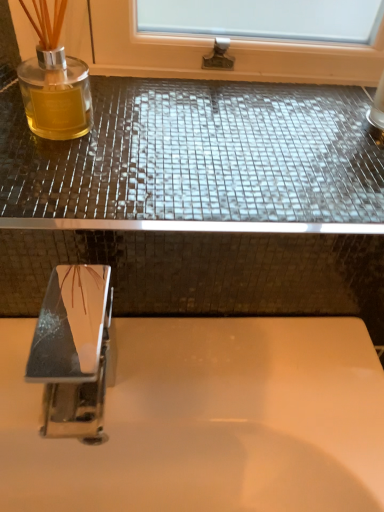
You are a GUI agent. You are given a task and a screenshot of the screen. Output one action in this format:
    pyautogui.click(x=<x>, y=<y>)
    Task: Click on the empty space that is ontop of shiny mosaic tile counter top at upper center (from a real-world perspective)
    The width and height of the screenshot is (384, 512).
    Given the screenshot: What is the action you would take?
    pyautogui.click(x=215, y=150)